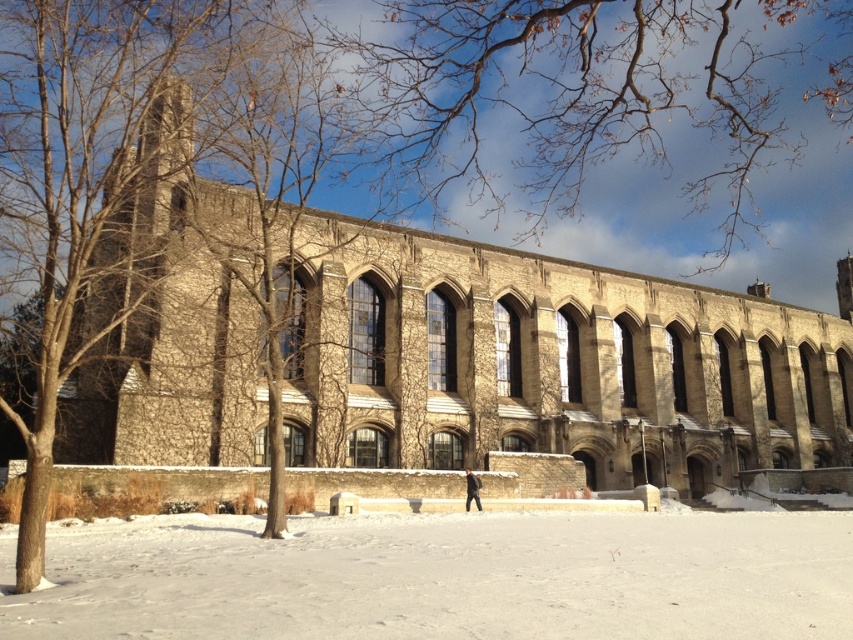
You are standing at the entrance of the historic Gothic building and want to walk towards the point marked as point (296, 433). However, there is an obstacle at point (724, 552). Will you encounter the obstacle before reaching your destination?

Since point (296, 433) is behind point (724, 552), you will encounter the obstacle at point (724, 552) before reaching your destination at point (296, 433).

You are standing outside the brown stone church at center and want to walk to the white powdery snow at lower center. Which direction should you move relative to the church?

The brown stone church at center is above the white powdery snow at lower center, so you should move downward or forward towards the lower part of the scene to reach the snow.